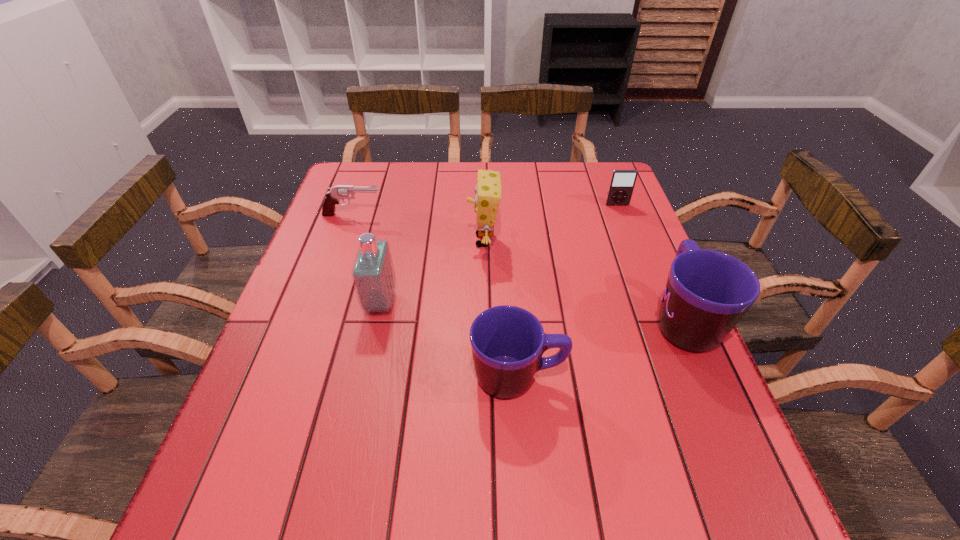
This screenshot has width=960, height=540. I want to click on the shorter mug, so click(x=507, y=342).

The height and width of the screenshot is (540, 960). I want to click on the left mug, so click(507, 342).

Find the location of a particular element. The height and width of the screenshot is (540, 960). the right mug is located at coordinates (707, 292).

I want to click on iPod, so click(x=622, y=182).

Identify the location of sponge. This screenshot has height=540, width=960. (488, 192).

Locate an element on the screen. This screenshot has height=540, width=960. gun is located at coordinates (342, 192).

Locate an element on the screen. This screenshot has height=540, width=960. the fifth object from right to left is located at coordinates (373, 275).

Where is `vacant space located with the handle on the side of the left mug`? The height and width of the screenshot is (540, 960). vacant space located with the handle on the side of the left mug is located at coordinates (620, 377).

Identify the location of vacant point located with the handle on the side of the taller mug. This screenshot has width=960, height=540. (660, 265).

Where is `vacant area situated with the handle on the side of the taller mug`? This screenshot has width=960, height=540. vacant area situated with the handle on the side of the taller mug is located at coordinates (629, 194).